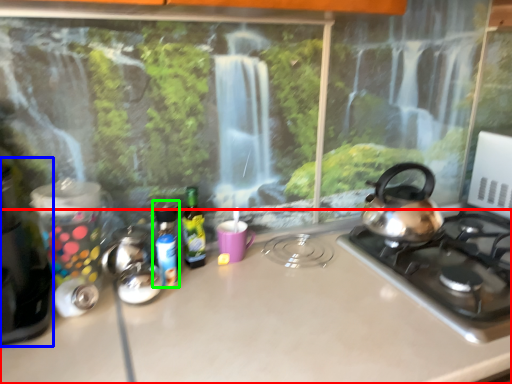
Question: Estimate the real-world distances between objects in this image. Which object is closer to countertop (highlighted by a red box), appliance (highlighted by a blue box) or bottle (highlighted by a green box)?

Choices:
 (A) appliance
 (B) bottle

Answer: (B)